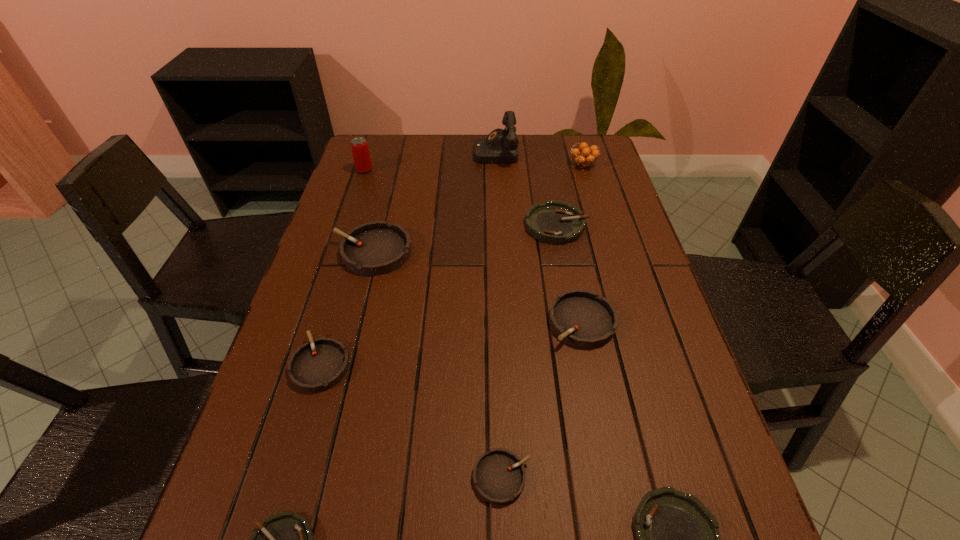
Where is `free location located on the front of the rightmost gray ashtray`? Image resolution: width=960 pixels, height=540 pixels. free location located on the front of the rightmost gray ashtray is located at coordinates (605, 434).

I want to click on vacant region located 0.270m on the back of the second smallest gray ashtray, so click(x=353, y=256).

Where is `vacant point located 0.250m on the left of the farthest green ashtray`? This screenshot has width=960, height=540. vacant point located 0.250m on the left of the farthest green ashtray is located at coordinates (438, 225).

Locate an element on the screen. Image resolution: width=960 pixels, height=540 pixels. vacant space located on the right of the fourth ashtray from right to left is located at coordinates (588, 477).

Locate an element on the screen. telephone present at the far edge is located at coordinates (501, 146).

Where is `beer can that is at the far edge`? This screenshot has height=540, width=960. beer can that is at the far edge is located at coordinates (x=359, y=146).

Identify the location of orange fruit situated at the far edge. Image resolution: width=960 pixels, height=540 pixels. (583, 158).

Where is `beer can that is at the left edge`? The image size is (960, 540). beer can that is at the left edge is located at coordinates (359, 146).

The image size is (960, 540). I want to click on orange fruit that is at the right edge, so click(583, 158).

I want to click on object present at the far left corner, so pos(359,146).